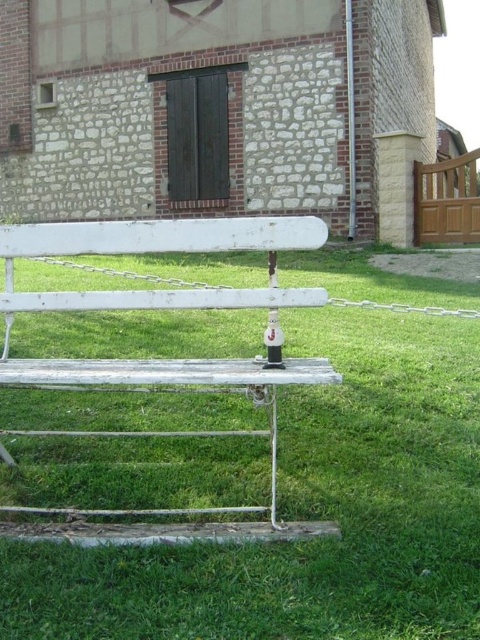
You are standing in front of the fence and want to determine which of the two points, point (436, 396) or point (56, 308), is closer to you. Based on the scene, which point is nearer?

Point (436, 396) is further to the viewer than point (56, 308). Therefore, point (56, 308) is closer to you.

You are a gardener who wants to mow the green grass at center. However, there is a white painted wood park bench at center in the way. Can you mow the grass without moving the bench?

The green grass at center is in front of the white painted wood park bench at center, so you can mow the grass without moving the bench because the grass is located in front of the bench and not underneath it.

You are a gardener who wants to mow the green grass at center. However, there is a white painted wood park bench at center in the way. Can you mow the grass without moving the bench?

The green grass at center has a lesser height compared to white painted wood park bench at center, so the mower can pass under the bench without obstruction. Therefore, you can mow the grass without moving the bench.